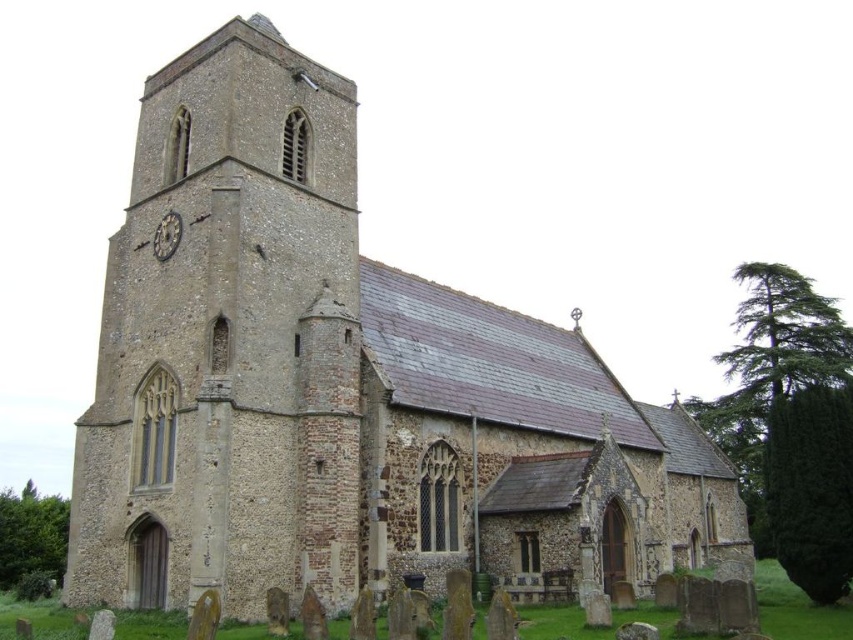
Question: Which object appears farthest from the camera in this image?

Choices:
 (A) dark gray stone clock at upper left
 (B) brown stone tower at left

Answer: (A)

Question: Can you confirm if brown stone tower at left is positioned below dark gray stone clock at upper left?

Choices:
 (A) yes
 (B) no

Answer: (A)

Question: Which object appears farthest from the camera in this image?

Choices:
 (A) brown stone tower at left
 (B) dark gray stone clock at upper left

Answer: (B)

Question: Can you confirm if brown stone tower at left is smaller than dark gray stone clock at upper left?

Choices:
 (A) no
 (B) yes

Answer: (A)

Question: From the image, what is the correct spatial relationship of brown stone tower at left in relation to dark gray stone clock at upper left?

Choices:
 (A) right
 (B) left

Answer: (A)